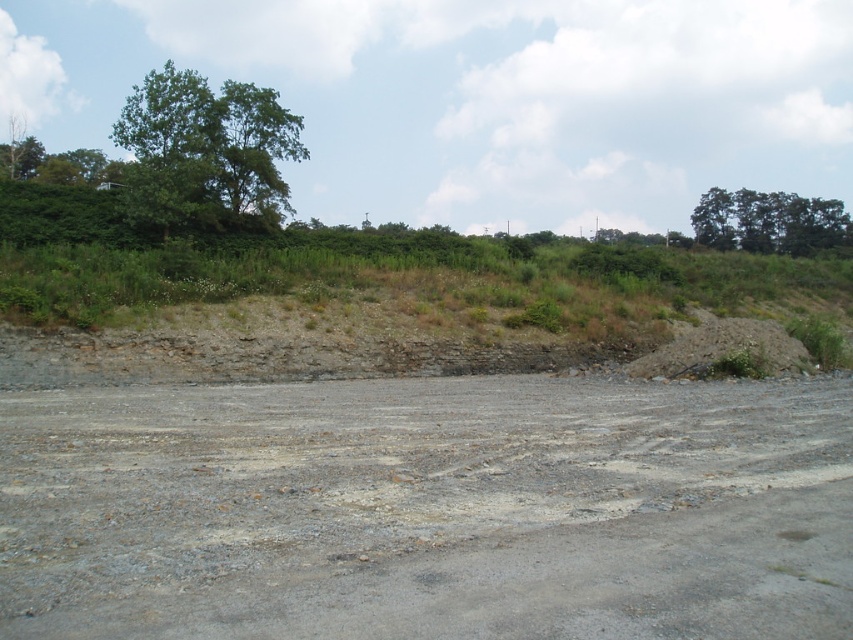
Between gray gravel dirt track at center and brown dirt hillside at upper center, which one has more height?

brown dirt hillside at upper center

Is point (722, 616) farther from viewer compared to point (434, 321)?

No, (722, 616) is closer to viewer.

Which is in front, point (451, 605) or point (523, 289)?

Positioned in front is point (451, 605).

Locate an element on the screen. The height and width of the screenshot is (640, 853). gray gravel dirt track at center is located at coordinates (428, 509).

Can you confirm if brown dirt hillside at upper center is thinner than green leafy trees at upper right?

Yes, brown dirt hillside at upper center is thinner than green leafy trees at upper right.

Image resolution: width=853 pixels, height=640 pixels. Identify the location of brown dirt hillside at upper center. (374, 316).

Between point (405, 358) and point (254, 140), which one is positioned behind?

The point (254, 140) is behind.

Who is shorter, brown dirt hillside at upper center or green leafy tree at upper left?

With less height is brown dirt hillside at upper center.

Is point (392, 308) farther from camera compared to point (202, 209)?

No.

Where is `brown dirt hillside at upper center`? Image resolution: width=853 pixels, height=640 pixels. brown dirt hillside at upper center is located at coordinates (374, 316).